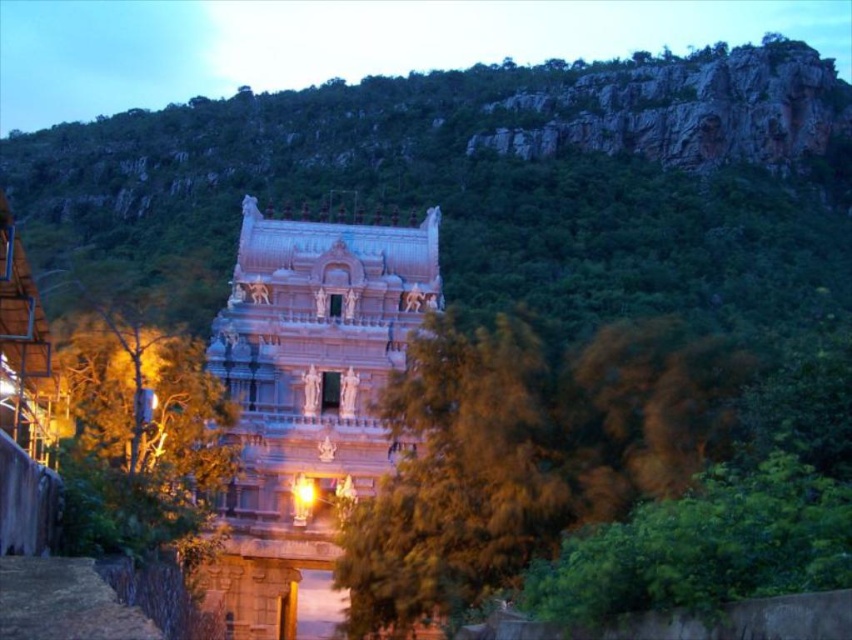
Question: Does green rocky hillside at upper center have a greater width compared to green leafy tree at left?

Choices:
 (A) no
 (B) yes

Answer: (B)

Question: Is green leafy tree at center closer to camera compared to white marble temple at center?

Choices:
 (A) no
 (B) yes

Answer: (B)

Question: Estimate the real-world distances between objects in this image. Which object is farther from the green leafy tree at left?

Choices:
 (A) green rocky hillside at upper center
 (B) white marble temple at center
 (C) green leafy tree at center

Answer: (A)

Question: Based on their relative distances, which object is farther from the green rocky hillside at upper center?

Choices:
 (A) green leafy tree at center
 (B) green leafy tree at left

Answer: (A)

Question: Where is green leafy tree at center located in relation to green leafy tree at left in the image?

Choices:
 (A) left
 (B) right

Answer: (B)

Question: Which object appears closest to the camera in this image?

Choices:
 (A) green leafy tree at left
 (B) white marble temple at center
 (C) green leafy tree at center

Answer: (C)